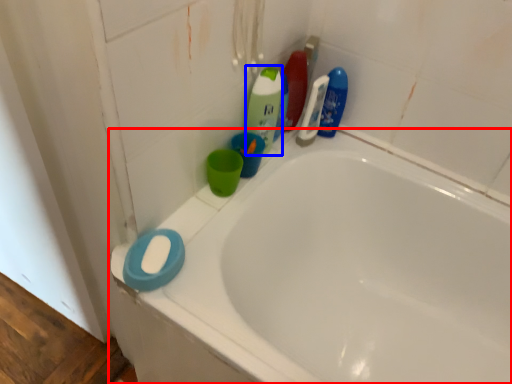
Question: Among these objects, which one is nearest to the camera, bathtub (highlighted by a red box) or cleaning product (highlighted by a blue box)?

Choices:
 (A) bathtub
 (B) cleaning product

Answer: (A)